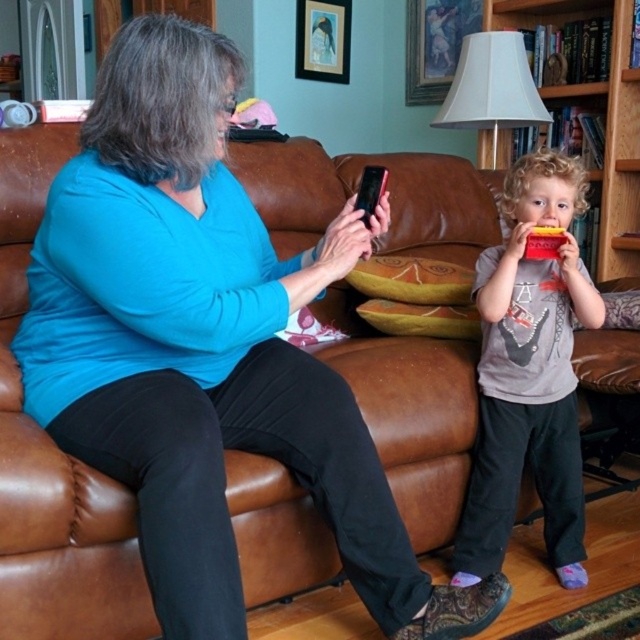
Is gray cotton shirt at right behind wooden bookshelf at right?

No, it is in front of wooden bookshelf at right.

Is gray cotton shirt at right above wooden bookshelf at right?

Incorrect, gray cotton shirt at right is not positioned above wooden bookshelf at right.

Identify the location of gray cotton shirt at right. The image size is (640, 640). (529, 376).

Does brown leather couch at center appear under gray cotton shirt at right?

Actually, brown leather couch at center is above gray cotton shirt at right.

Locate an element on the screen. The height and width of the screenshot is (640, 640). brown leather couch at center is located at coordinates (52, 460).

Is point (76, 577) closer to camera compared to point (564, 474)?

Yes, it is.

Where is `brown leather couch at center`? brown leather couch at center is located at coordinates (52, 460).

Does brown leather couch at center appear on the right side of wooden bookshelf at right?

In fact, brown leather couch at center is to the left of wooden bookshelf at right.

I want to click on brown leather couch at center, so click(52, 460).

Who is more forward, (433, 374) or (525, 4)?

Point (433, 374) is in front.

Find the location of a particular element. brown leather couch at center is located at coordinates (52, 460).